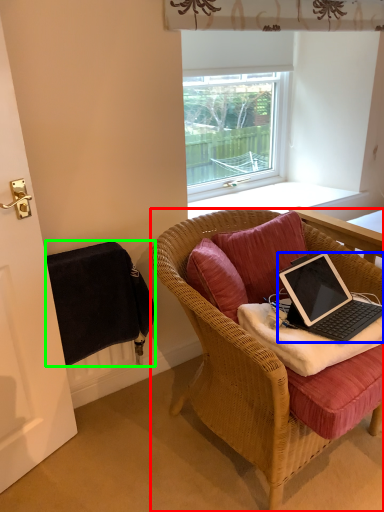
Question: Considering the real-world distances, which object is closest to chair (highlighted by a red box)? laptop (highlighted by a blue box) or radiator (highlighted by a green box).

Choices:
 (A) laptop
 (B) radiator

Answer: (A)